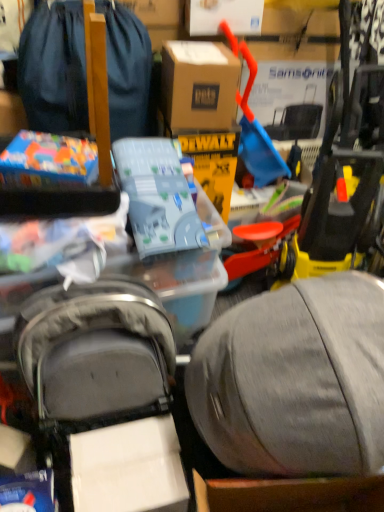
Question: Considering the positions of brown cardboard box at center and matte plastic toy at upper left, the second toy from the right, in the image, is brown cardboard box at center taller or shorter than matte plastic toy at upper left, the second toy from the right,?

Choices:
 (A) tall
 (B) short

Answer: (A)

Question: Is brown cardboard box at center to the left or to the right of matte plastic toy at upper left, the second toy from the right, in the image?

Choices:
 (A) right
 (B) left

Answer: (A)

Question: Based on their relative distances, which object is farther from the brown cardboard box at center?

Choices:
 (A) translucent plastic toy at center, which is the second toy in left-to-right order
 (B) matte black backpack at upper left
 (C) matte plastic toy at upper left, marked as the first toy in a left-to-right arrangement

Answer: (C)

Question: Considering the real-world distances, which object is closest to the translucent plastic toy at center, which appears as the first toy when viewed from the right?

Choices:
 (A) matte black backpack at upper left
 (B) brown cardboard box at center
 (C) matte plastic toy at upper left, the second toy from the right

Answer: (C)